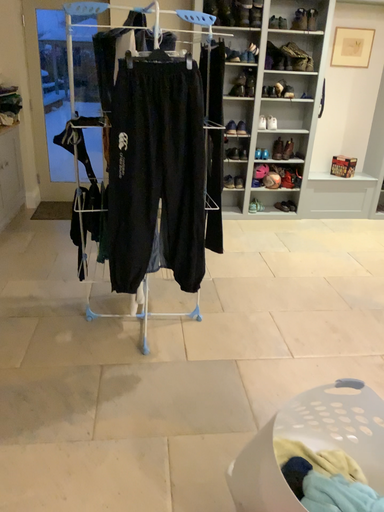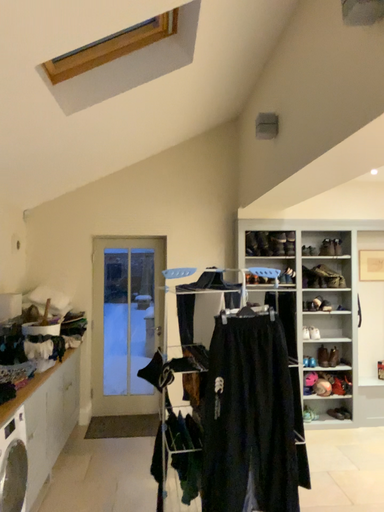
Question: How did the camera likely rotate when shooting the video?

Choices:
 (A) rotated downward
 (B) rotated upward

Answer: (B)